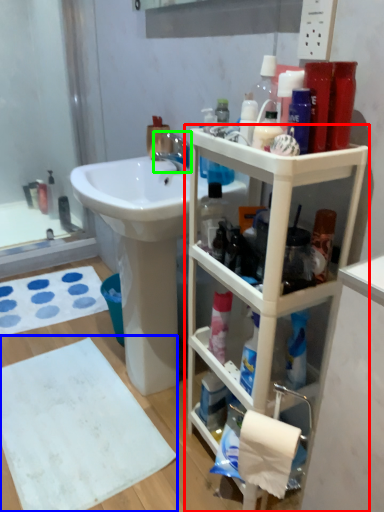
Question: Which is nearer to the bathroom cabinet (highlighted by a red box)? bath towel (highlighted by a blue box) or tap (highlighted by a green box).

Choices:
 (A) bath towel
 (B) tap

Answer: (A)